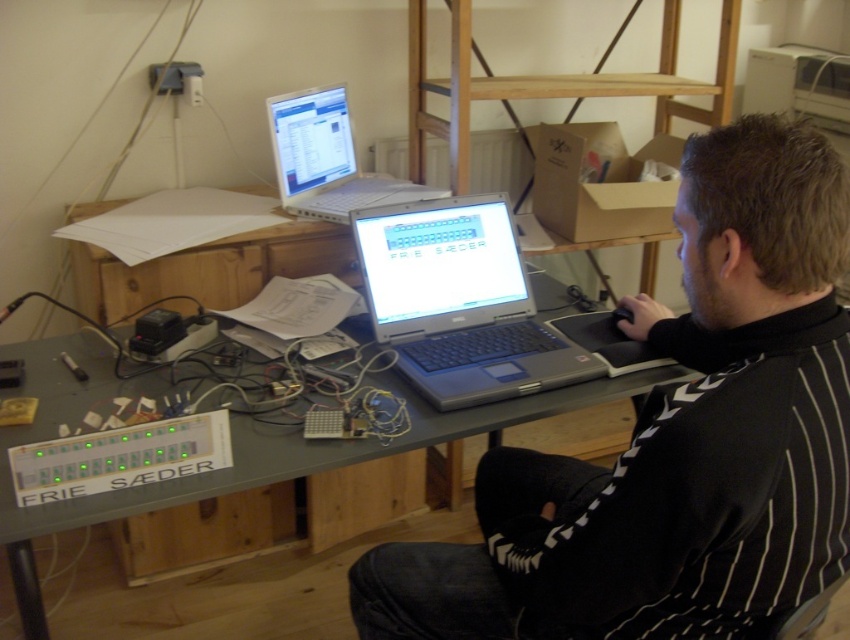
Question: Which object is positioned closest to the silver/black plastic laptop at center?

Choices:
 (A) black striped shirt at center
 (B) gray plastic desk at center
 (C) silver metallic laptop at center

Answer: (B)

Question: Among these objects, which one is farthest from the camera?

Choices:
 (A) gray plastic desk at center
 (B) silver metallic laptop at center
 (C) black striped shirt at center

Answer: (B)

Question: Is black striped shirt at center to the right of silver metallic laptop at center from the viewer's perspective?

Choices:
 (A) yes
 (B) no

Answer: (A)

Question: Can you confirm if black striped shirt at center is positioned below gray plastic desk at center?

Choices:
 (A) no
 (B) yes

Answer: (A)

Question: Is gray plastic desk at center thinner than silver/black plastic laptop at center?

Choices:
 (A) yes
 (B) no

Answer: (B)

Question: Which is farther from the silver metallic laptop at center?

Choices:
 (A) silver/black plastic laptop at center
 (B) black striped shirt at center
 (C) gray plastic desk at center

Answer: (B)